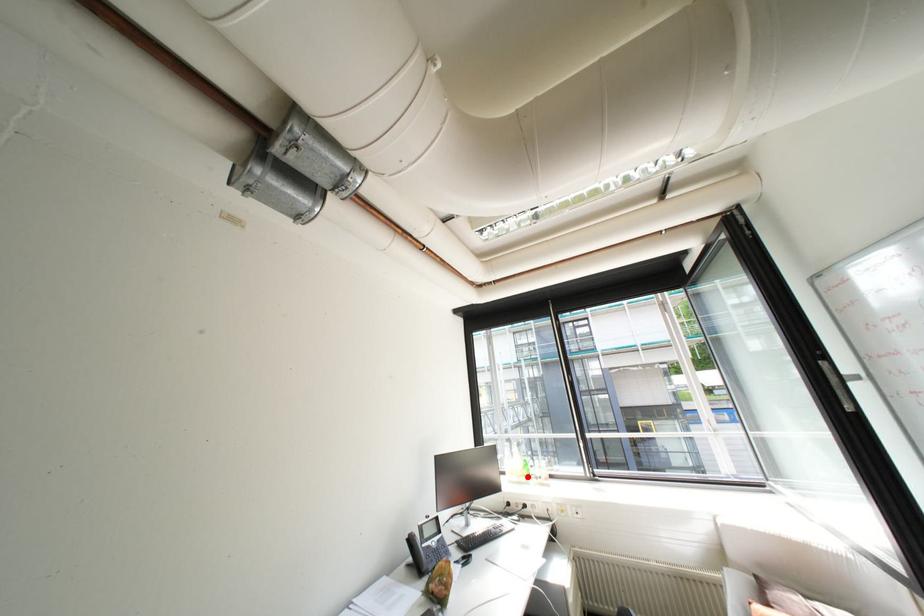
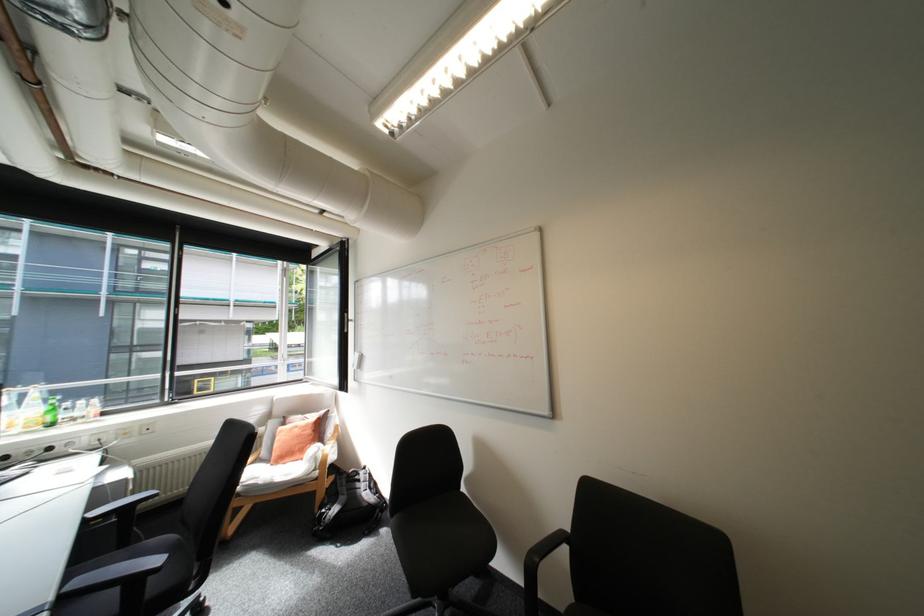
Question: I am providing you with two images of the same scene from different viewpoints. Given a red point in image1, look at the same physical point in image2. Is it:

Choices:
 (A) Closer to the viewpoint
 (B) Farther from the viewpoint

Answer: (A)